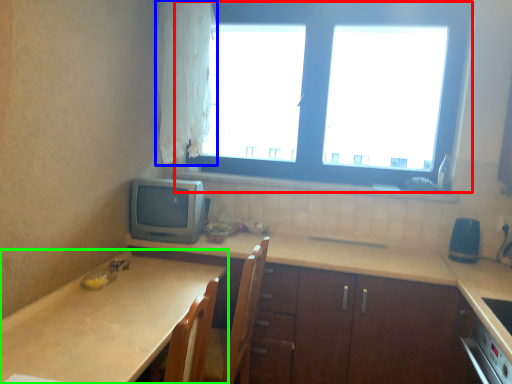
Question: Which is farther away from window (highlighted by a red box)? curtain (highlighted by a blue box) or countertop (highlighted by a green box)?

Choices:
 (A) curtain
 (B) countertop

Answer: (B)